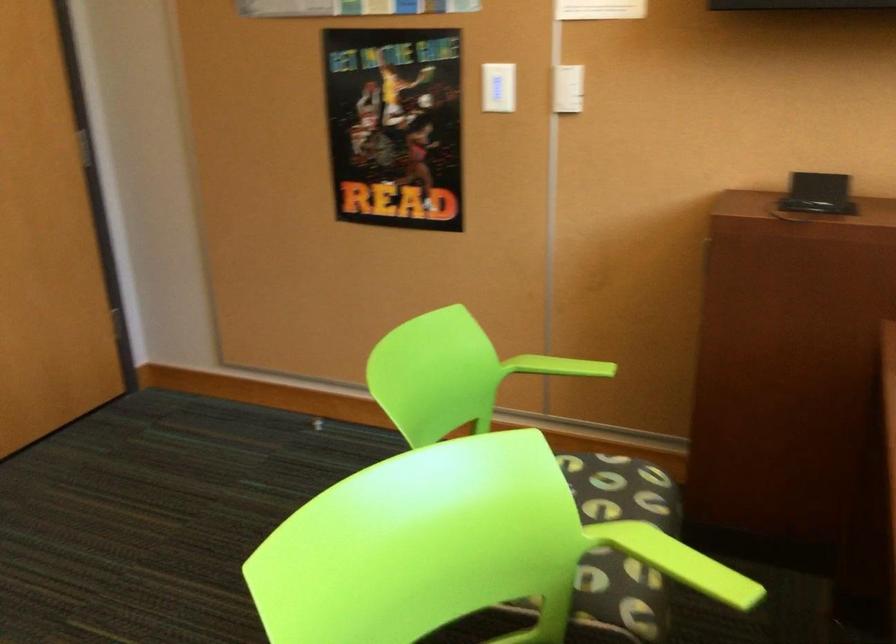
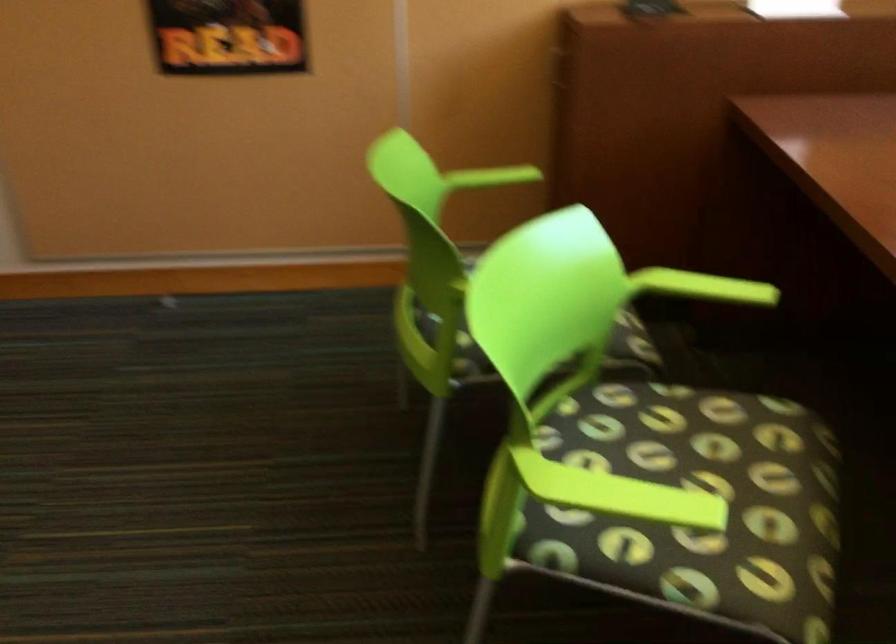
Question: The camera is either moving clockwise (left) or counter-clockwise (right) around the object. The first image is from the beginning of the video and the second image is from the end. Is the camera moving left or right when shooting the video?

Choices:
 (A) Left
 (B) Right

Answer: (A)